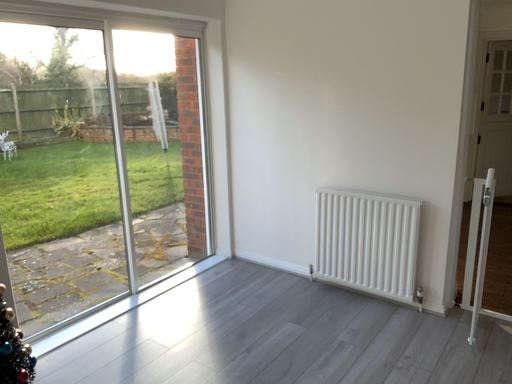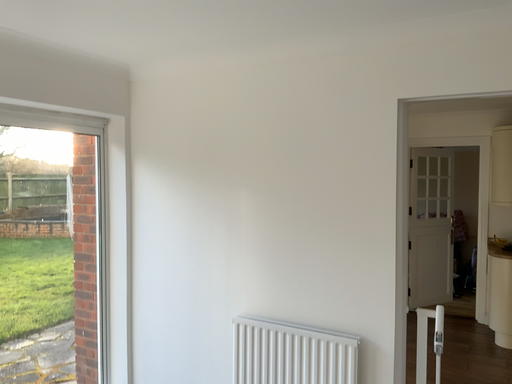
Question: Which way did the camera rotate in the video?

Choices:
 (A) rotated left
 (B) rotated right

Answer: (B)